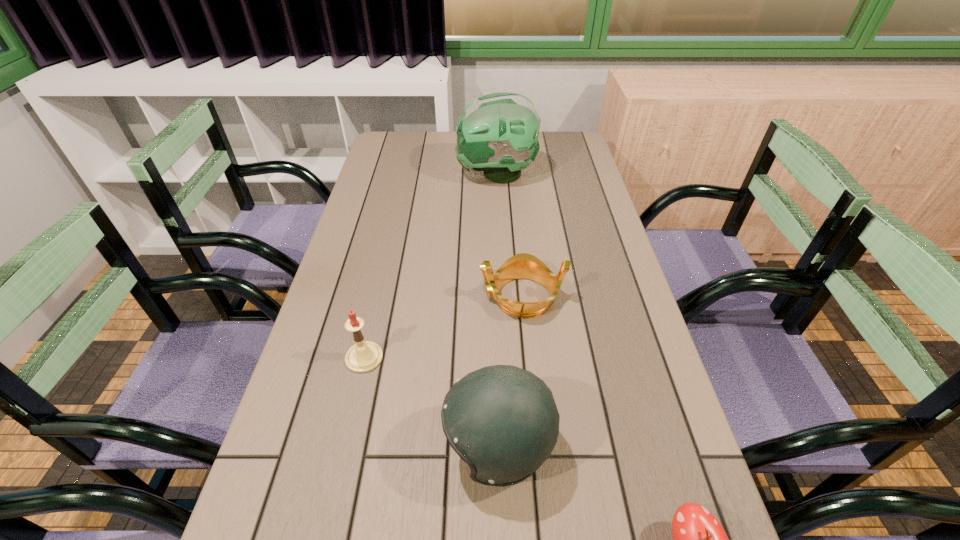
You are a GUI agent. You are given a task and a screenshot of the screen. Output one action in this format:
    pyautogui.click(x=<x>, y=<y>)
    Task: Click on the free space located 0.310m at the face opening of the second tallest object
    Image resolution: width=960 pixels, height=540 pixels.
    Given the screenshot: What is the action you would take?
    pyautogui.click(x=283, y=446)

Locate an element on the screen. The height and width of the screenshot is (540, 960). free region located 0.240m at the face opening of the second tallest object is located at coordinates (320, 446).

In order to click on vacant space located at the face opening of the second tallest object in this screenshot , I will do `click(372, 446)`.

Locate an element on the screen. The image size is (960, 540). free space located 0.210m on the front of the leftmost object is located at coordinates (339, 470).

Locate an element on the screen. blank area located 0.150m at the front emblem of the fourth nearest object is located at coordinates (421, 296).

This screenshot has height=540, width=960. Identify the location of vacant area situated 0.140m at the front emblem of the fourth nearest object. (425, 296).

Locate an element on the screen. The image size is (960, 540). free space located at the front emblem of the fourth nearest object is located at coordinates (335, 296).

Image resolution: width=960 pixels, height=540 pixels. In order to click on object that is at the far edge in this screenshot , I will do `click(497, 133)`.

Identify the location of object that is at the left edge. The image size is (960, 540). (364, 356).

Where is `vacant space at the far edge of the desktop`? The width and height of the screenshot is (960, 540). vacant space at the far edge of the desktop is located at coordinates (455, 153).